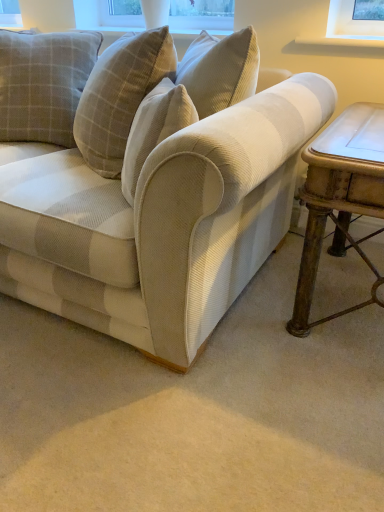
Question: Does beige corduroy couch at center have a smaller size compared to rustic wood table at right?

Choices:
 (A) yes
 (B) no

Answer: (B)

Question: Does beige corduroy couch at center have a lesser height compared to rustic wood table at right?

Choices:
 (A) yes
 (B) no

Answer: (B)

Question: Is beige corduroy couch at center oriented away from rustic wood table at right?

Choices:
 (A) yes
 (B) no

Answer: (B)

Question: From a real-world perspective, is beige corduroy couch at center positioned under rustic wood table at right based on gravity?

Choices:
 (A) yes
 (B) no

Answer: (B)

Question: From the image's perspective, would you say beige corduroy couch at center is positioned over rustic wood table at right?

Choices:
 (A) yes
 (B) no

Answer: (A)

Question: Would you say beige corduroy couch at center is inside or outside plaid fabric pillow at upper left?

Choices:
 (A) outside
 (B) inside

Answer: (A)

Question: In terms of width, does beige corduroy couch at center look wider or thinner when compared to plaid fabric pillow at upper left?

Choices:
 (A) thin
 (B) wide

Answer: (B)

Question: Is beige corduroy couch at center taller or shorter than plaid fabric pillow at upper left?

Choices:
 (A) short
 (B) tall

Answer: (B)

Question: Is point (24, 270) closer or farther from the camera than point (23, 117)?

Choices:
 (A) closer
 (B) farther

Answer: (A)

Question: From a real-world perspective, is beige corduroy couch at center positioned above or below rustic wood table at right?

Choices:
 (A) above
 (B) below

Answer: (A)

Question: Is beige corduroy couch at center in front of or behind rustic wood table at right in the image?

Choices:
 (A) front
 (B) behind

Answer: (A)

Question: Looking at their shapes, would you say beige corduroy couch at center is wider or thinner than rustic wood table at right?

Choices:
 (A) wide
 (B) thin

Answer: (A)

Question: From the image's perspective, is beige corduroy couch at center above or below rustic wood table at right?

Choices:
 (A) above
 (B) below

Answer: (A)

Question: Based on their sizes in the image, would you say plaid fabric pillow at upper left is bigger or smaller than beige corduroy couch at center?

Choices:
 (A) small
 (B) big

Answer: (A)

Question: Which is correct: plaid fabric pillow at upper left is inside beige corduroy couch at center, or outside of it?

Choices:
 (A) outside
 (B) inside

Answer: (B)